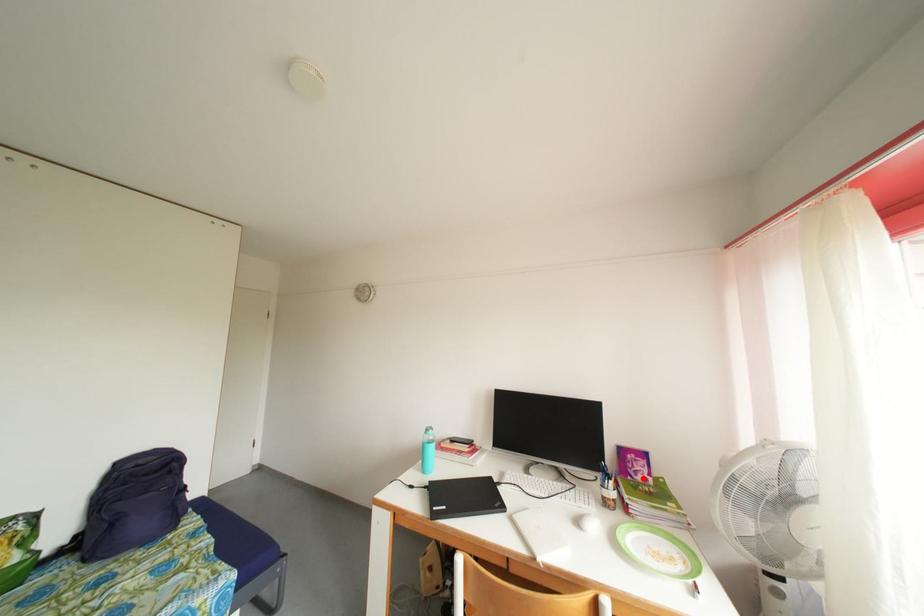
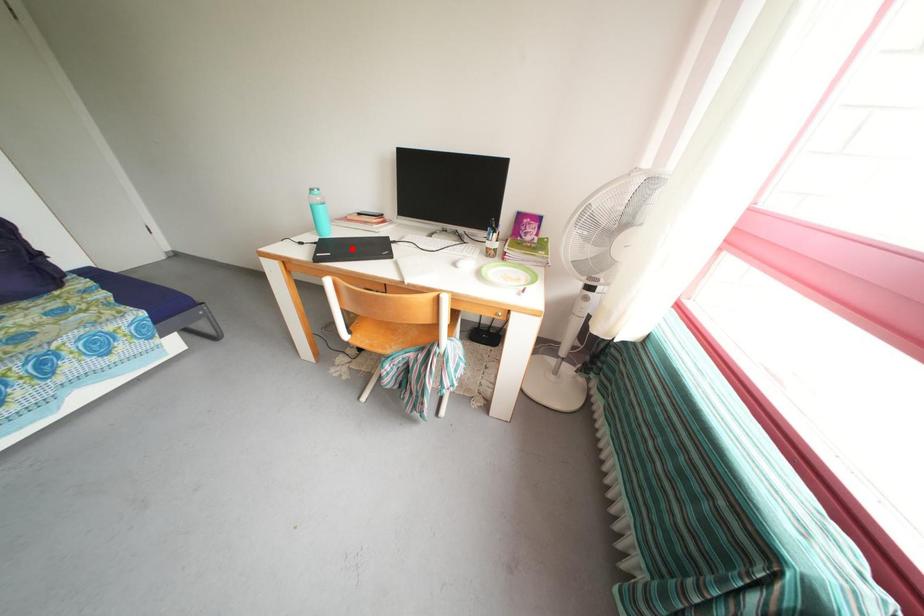
I am providing you with two images of the same scene from different viewpoints. A red point is marked on the first image and another point is marked on the second image. Are the points marked in image1 and image2 representing the same 3D position?

No